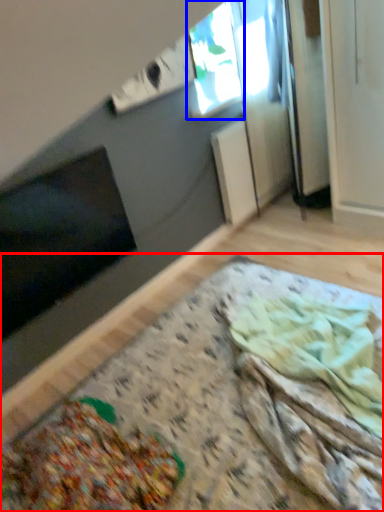
Question: Which object appears farthest to the camera in this image, table (highlighted by a red box) or window (highlighted by a blue box)?

Choices:
 (A) table
 (B) window

Answer: (B)